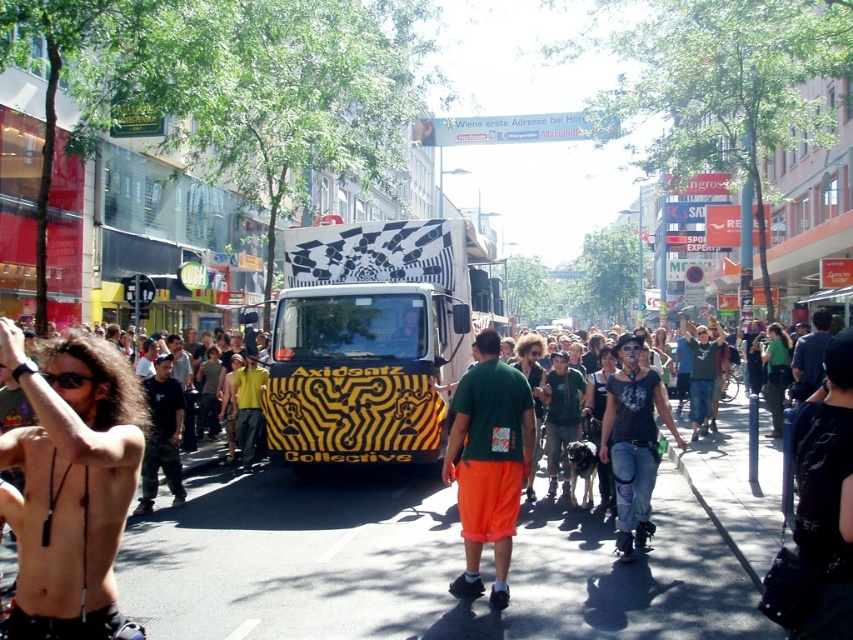
How much distance is there between yellow and black striped bus at center and green fabric shirt at center?

The distance of yellow and black striped bus at center from green fabric shirt at center is 17.82 feet.

Where is `yellow and black striped bus at center`? yellow and black striped bus at center is located at coordinates (372, 339).

Describe the element at coordinates (372, 339) in the screenshot. I see `yellow and black striped bus at center` at that location.

Where is `yellow and black striped bus at center`? yellow and black striped bus at center is located at coordinates (372, 339).

Can you confirm if shiny black hair at left is taller than dark blue jeans at center?

Incorrect, shiny black hair at left's height is not larger of dark blue jeans at center's.

Can you confirm if shiny black hair at left is positioned below dark blue jeans at center?

No, shiny black hair at left is not below dark blue jeans at center.

Which is behind, point (125, 384) or point (169, 468)?

Point (169, 468)

This screenshot has width=853, height=640. Identify the location of shiny black hair at left. (70, 484).

Is dark blue jeans at center taller than dark blue shirt at center?

Indeed, dark blue jeans at center has a greater height compared to dark blue shirt at center.

Between point (154, 493) and point (804, 387), which one is positioned behind?

The point (804, 387) is more distant.

Locate an element on the screen. The width and height of the screenshot is (853, 640). dark blue jeans at center is located at coordinates (161, 435).